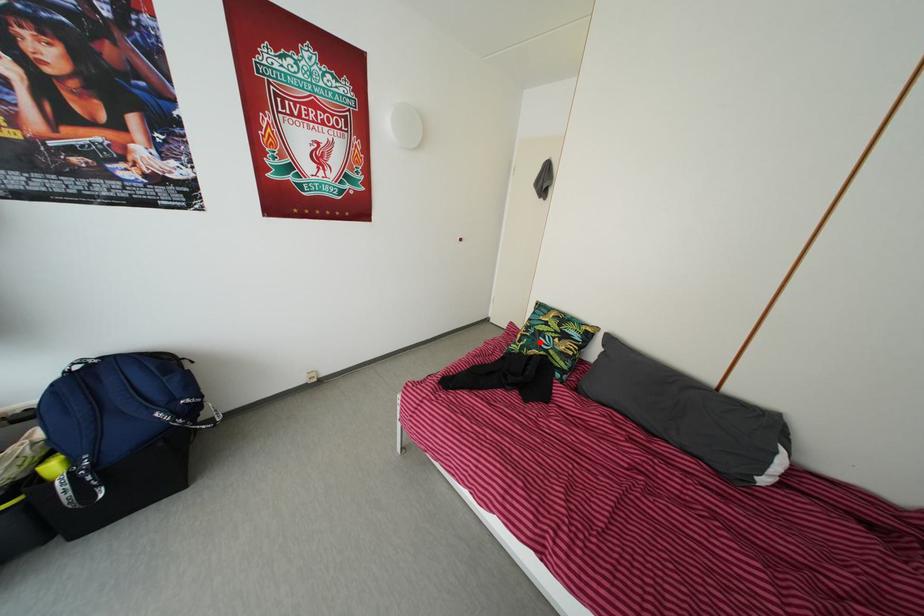
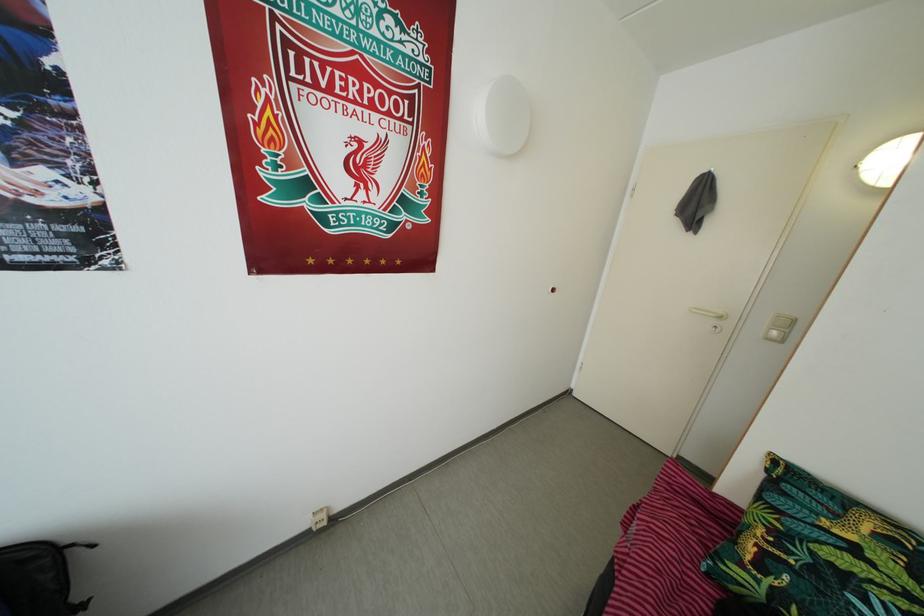
Where in the second image is the point corresponding to the highlighted location from the first image?

(820, 578)